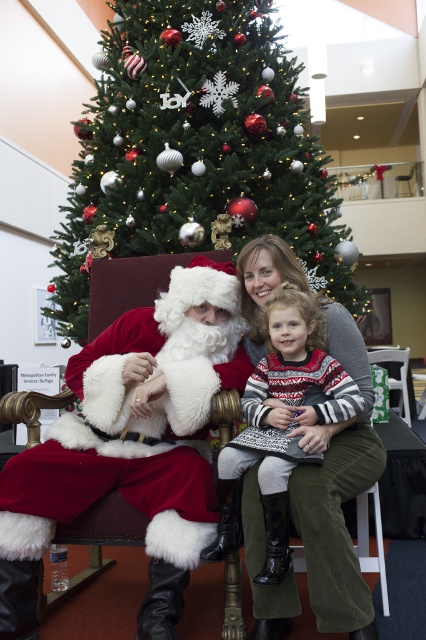
Question: Is green textured christmas tree at center smaller than fuzzy white santa at center?

Choices:
 (A) yes
 (B) no

Answer: (B)

Question: Which is nearer to the green textured christmas tree at center?

Choices:
 (A) fuzzy white santa at center
 (B) knitted sweater at center

Answer: (A)

Question: Does fuzzy white santa at center have a lesser width compared to knitted sweater at center?

Choices:
 (A) no
 (B) yes

Answer: (A)

Question: Which is farther from the knitted sweater at center?

Choices:
 (A) fuzzy white santa at center
 (B) green textured christmas tree at center

Answer: (B)

Question: Which object is positioned closest to the fuzzy white santa at center?

Choices:
 (A) knitted sweater at center
 (B) green textured christmas tree at center

Answer: (A)

Question: Is fuzzy white santa at center above knitted sweater at center?

Choices:
 (A) yes
 (B) no

Answer: (B)